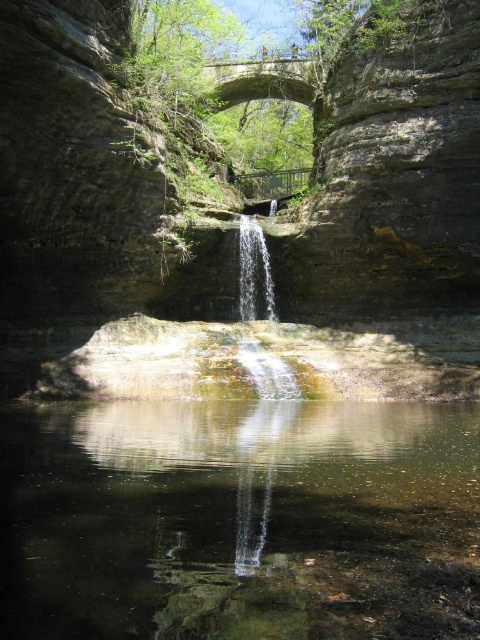
You are standing at the base of the smooth rock waterfall at center, and you want to take a photo of it. If your camera can focus on objects up to 30 meters away, will it be able to capture the waterfall clearly?

The smooth rock waterfall at center is 31.53 meters from camera, which is beyond the camera focus range of 30 meters. Therefore, the camera cannot capture the waterfall clearly.

You are standing on the bridge above the waterfall and want to take a photo of both the smooth rock waterfall at center and the clear water at center. Which object should you pan your camera to the left to capture?

You should pan your camera to the left to capture the clear water at center because the smooth rock waterfall at center is to the right of it.